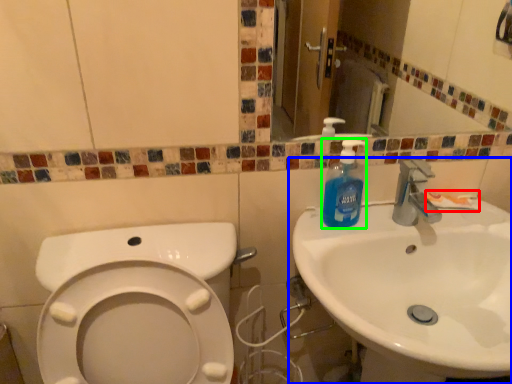
Question: Which object is the closest to the toothpaste (highlighted by a red box)? Choose among these: sink (highlighted by a blue box) or cleaning product (highlighted by a green box).

Choices:
 (A) sink
 (B) cleaning product

Answer: (B)